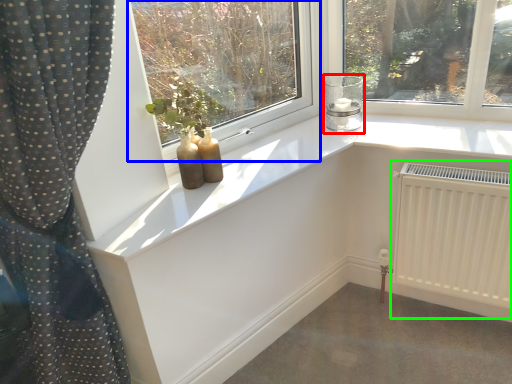
Question: Which object is positioned closest to candle holder (highlighted by a red box)? Select from window (highlighted by a blue box) and radiator (highlighted by a green box).

Choices:
 (A) window
 (B) radiator

Answer: (B)